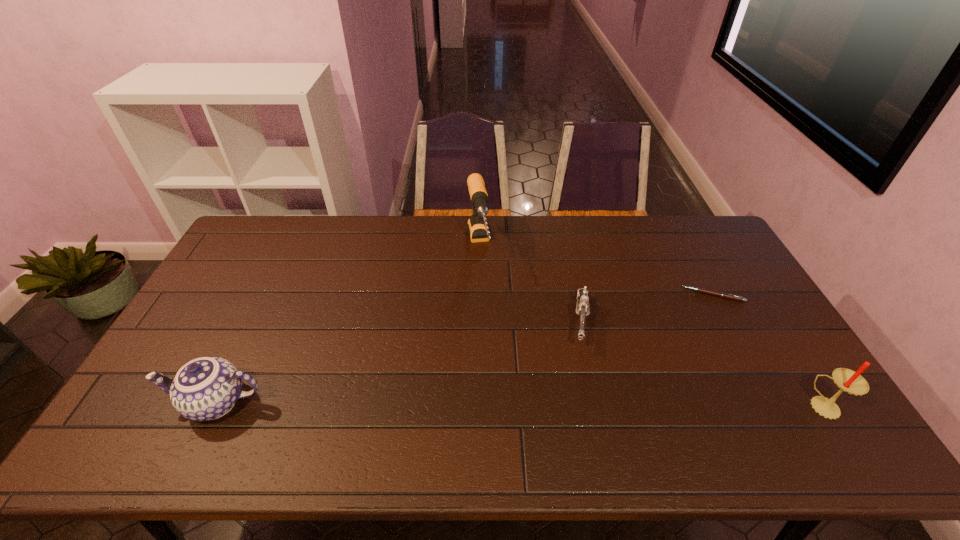
At what (x,y) coordinates should I click in order to perform the action: click on free point at the near edge. Please return your answer as a coordinate pair (x, y). The width and height of the screenshot is (960, 540). Looking at the image, I should click on (636, 414).

At what (x,y) coordinates should I click in order to perform the action: click on free space at the left edge. Please return your answer as a coordinate pair (x, y). Looking at the image, I should click on (243, 267).

Find the location of `vacant space at the right edge of the desktop`. vacant space at the right edge of the desktop is located at coordinates (706, 277).

The width and height of the screenshot is (960, 540). In order to click on free space at the far left corner in this screenshot , I will do `click(252, 226)`.

This screenshot has width=960, height=540. I want to click on empty space that is in between the gun and the pen, so click(647, 308).

The image size is (960, 540). Identify the location of vacant area between the rightmost object and the farthest object. (652, 326).

Where is `free area in between the third object from left to right and the third shortest object`? This screenshot has width=960, height=540. free area in between the third object from left to right and the third shortest object is located at coordinates (398, 362).

The height and width of the screenshot is (540, 960). In order to click on empty location between the candle and the chinaware in this screenshot , I will do `click(520, 404)`.

You are a GUI agent. You are given a task and a screenshot of the screen. Output one action in this format:
    pyautogui.click(x=<x>, y=<y>)
    Task: Click on the free space between the third object from left to right and the drill
    
    Given the screenshot: What is the action you would take?
    pyautogui.click(x=530, y=284)

Find the location of a particular element. free space between the drill and the shortest object is located at coordinates (596, 271).